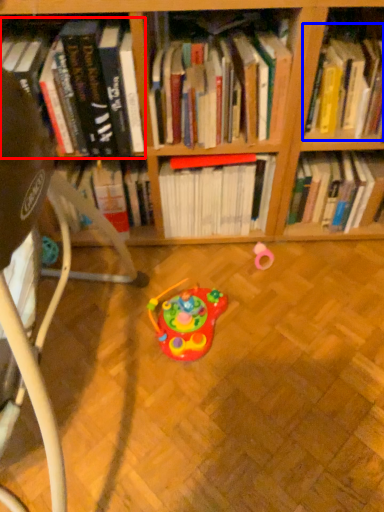
Question: Which of the following is the closest to the observer, book (highlighted by a red box) or book (highlighted by a blue box)?

Choices:
 (A) book
 (B) book

Answer: (A)